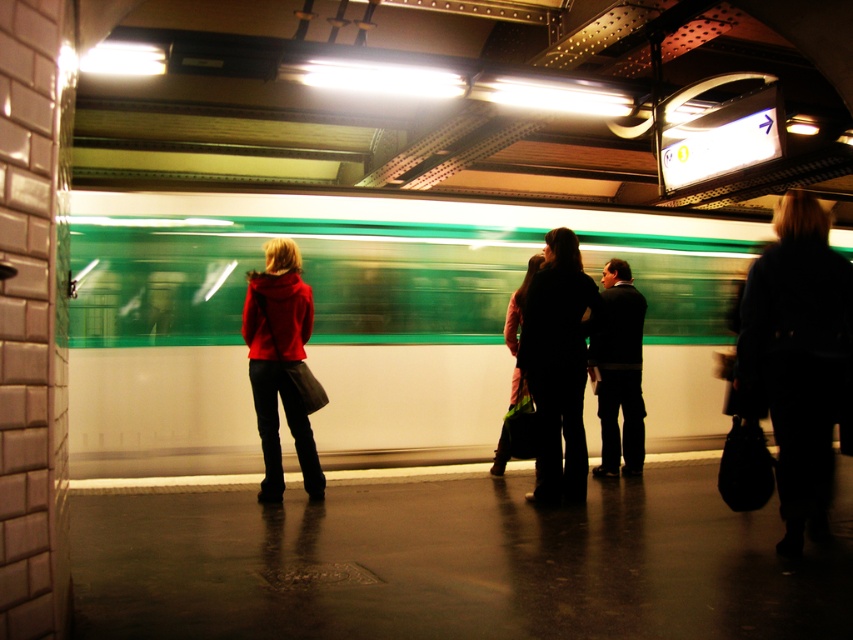
Question: Is dark suit at center positioned at the back of matte black coat at center?

Choices:
 (A) no
 (B) yes

Answer: (B)

Question: Is dark blue coat at right smaller than matte red jacket at left?

Choices:
 (A) no
 (B) yes

Answer: (A)

Question: Can you confirm if matte red jacket at left is positioned to the left of dark suit at center?

Choices:
 (A) yes
 (B) no

Answer: (A)

Question: Which point is farther to the camera?

Choices:
 (A) (175, 336)
 (B) (502, 468)

Answer: (A)

Question: Which object appears closest to the camera in this image?

Choices:
 (A) green glossy train at center
 (B) dark suit at center
 (C) matte red jacket at left
 (D) dark blue coat at right

Answer: (D)

Question: Which point is closer to the camera?

Choices:
 (A) (517, 339)
 (B) (833, 300)

Answer: (B)